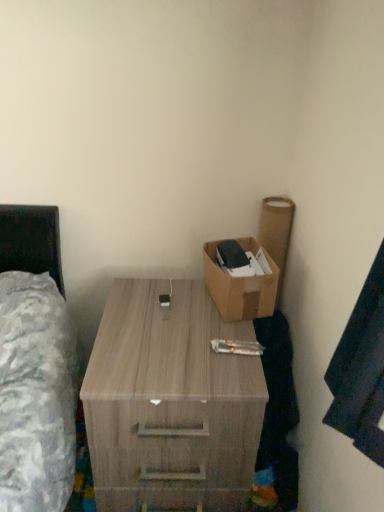
Image resolution: width=384 pixels, height=512 pixels. I want to click on vacant area that is in front of brown cardboard box at upper right, so click(208, 334).